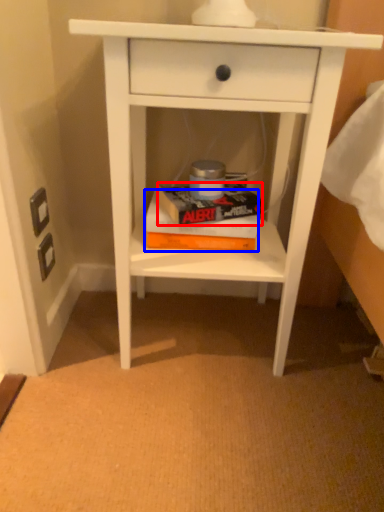
Question: Which point is closer to the camera, paperback book (highlighted by a red box) or paperback book (highlighted by a blue box)?

Choices:
 (A) paperback book
 (B) paperback book

Answer: (A)